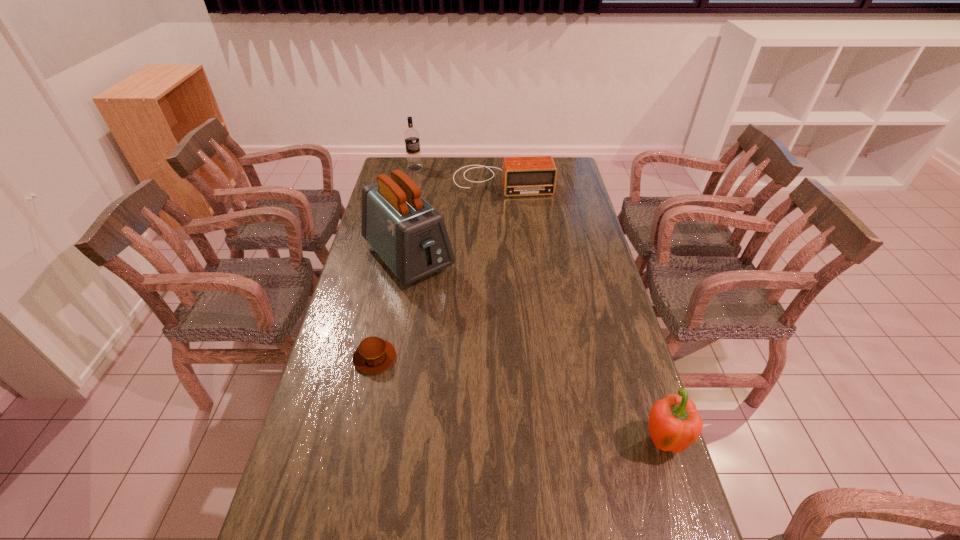
The image size is (960, 540). Identify the location of vacant spot on the desktop that is between the muffin and the rightmost object and is positioned on the label of the vodka. (494, 393).

At what (x,y) coordinates should I click in order to perform the action: click on free space on the desktop that is between the fourth farthest object and the rightmost object and is positioned on the front-facing side of the third farthest object. Please return your answer as a coordinate pair (x, y). Looking at the image, I should click on (544, 408).

The width and height of the screenshot is (960, 540). In order to click on free spot on the desktop that is between the muffin and the rightmost object and is positioned on the front-facing side of the radio receiver in this screenshot , I will do `click(547, 408)`.